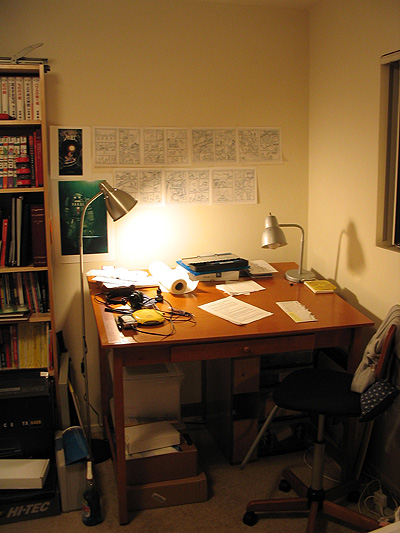
The width and height of the screenshot is (400, 533). In order to click on front edge of bookcase shelf in this screenshot , I will do `click(29, 123)`, `click(28, 270)`, `click(34, 189)`, `click(37, 319)`, `click(51, 374)`.